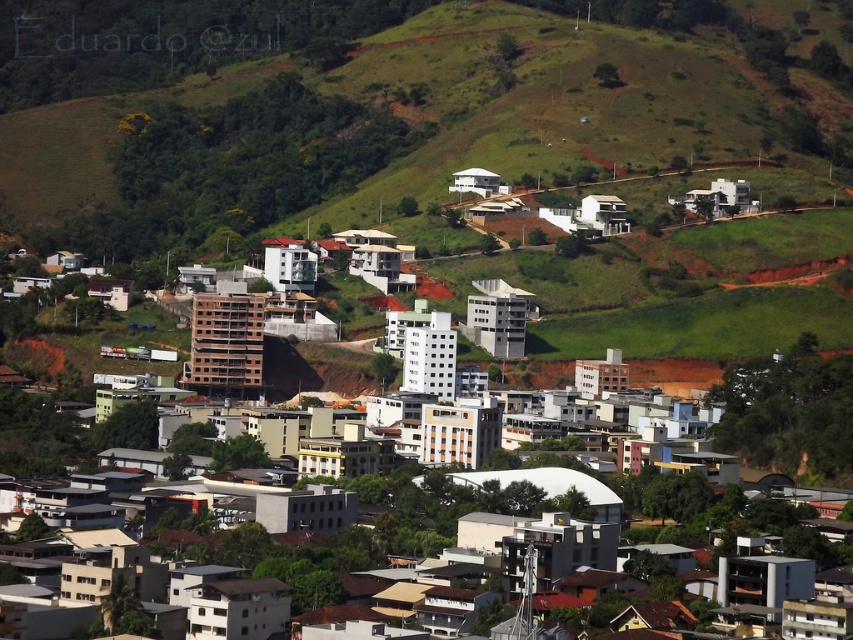
Question: Can you confirm if green grassy hillside at upper center is bigger than white matte building at center?

Choices:
 (A) no
 (B) yes

Answer: (B)

Question: Which point is farther from the camera taking this photo?

Choices:
 (A) click(x=763, y=458)
 (B) click(x=647, y=145)

Answer: (A)

Question: Among these objects, which one is nearest to the camera?

Choices:
 (A) green grassy hillside at upper center
 (B) white matte building at center

Answer: (A)

Question: Which of the following is the farthest from the observer?

Choices:
 (A) (850, 390)
 (B) (654, 4)

Answer: (B)

Question: Can you confirm if green grassy hillside at upper center is smaller than white matte building at center?

Choices:
 (A) no
 (B) yes

Answer: (A)

Question: Is green grassy hillside at upper center positioned behind white matte building at center?

Choices:
 (A) no
 (B) yes

Answer: (A)